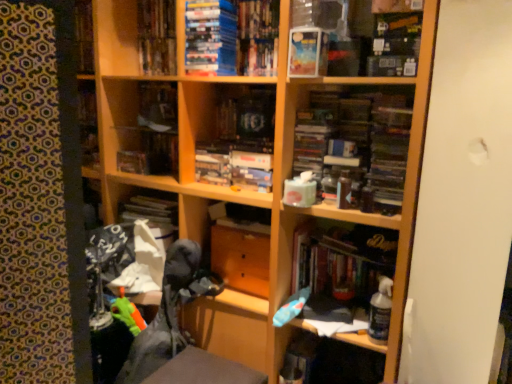
Question: Is the position of matte plastic book at upper center, the 2th book in the top-to-bottom sequence, less distant than that of wooden drawer at center?

Choices:
 (A) yes
 (B) no

Answer: (A)

Question: Is wooden drawer at center completely or partially inside matte plastic book at upper center, the 2th book in the top-to-bottom sequence?

Choices:
 (A) no
 (B) yes

Answer: (A)

Question: Can you confirm if matte plastic book at upper center, the third book from the bottom, is bigger than wooden drawer at center?

Choices:
 (A) no
 (B) yes

Answer: (A)

Question: Can you confirm if matte plastic book at upper center, the third book from the bottom, is smaller than wooden drawer at center?

Choices:
 (A) no
 (B) yes

Answer: (B)

Question: From the image's perspective, does matte plastic book at upper center, the 2th book in the top-to-bottom sequence, appear higher than wooden drawer at center?

Choices:
 (A) no
 (B) yes

Answer: (B)

Question: Considering the positions of hardcover book at center, which is the 1th book in bottom-to-top order, and matte plastic book at center, which ranks as the 2th book in bottom-to-top order, in the image, is hardcover book at center, which is the 1th book in bottom-to-top order, taller or shorter than matte plastic book at center, which ranks as the 2th book in bottom-to-top order,?

Choices:
 (A) short
 (B) tall

Answer: (B)

Question: From the image's perspective, is hardcover book at center, the fourth book from the left, above or below matte plastic book at center, the first book from the left?

Choices:
 (A) above
 (B) below

Answer: (B)

Question: Relative to matte plastic book at center, the first book from the left, is hardcover book at center, the fourth book from the left, in front or behind?

Choices:
 (A) front
 (B) behind

Answer: (A)

Question: Is hardcover book at center, which appears as the fourth book when viewed from the top, spatially inside matte plastic book at center, arranged as the 3th book when viewed from the top, or outside of it?

Choices:
 (A) outside
 (B) inside

Answer: (A)

Question: From a real-world perspective, is wooden drawer at center positioned above or below hardcover books at upper center, the 2th book from the left?

Choices:
 (A) above
 (B) below

Answer: (B)

Question: Which is correct: wooden drawer at center is inside hardcover books at upper center, placed as the fourth book when sorted from bottom to top, or outside of it?

Choices:
 (A) outside
 (B) inside

Answer: (A)

Question: Visually, is wooden drawer at center positioned to the left or to the right of hardcover books at upper center, the 3th book from the right?

Choices:
 (A) left
 (B) right

Answer: (B)

Question: From the image's perspective, is wooden drawer at center positioned above or below hardcover books at upper center, marked as the first book in a top-to-bottom arrangement?

Choices:
 (A) above
 (B) below

Answer: (B)

Question: Based on their positions, is hardcover book at center, which appears as the fourth book when viewed from the top, located to the left or right of matte plastic paperback book at upper center?

Choices:
 (A) left
 (B) right

Answer: (B)

Question: Considering the positions of point (330, 238) and point (306, 28), is point (330, 238) closer or farther from the camera than point (306, 28)?

Choices:
 (A) closer
 (B) farther

Answer: (B)